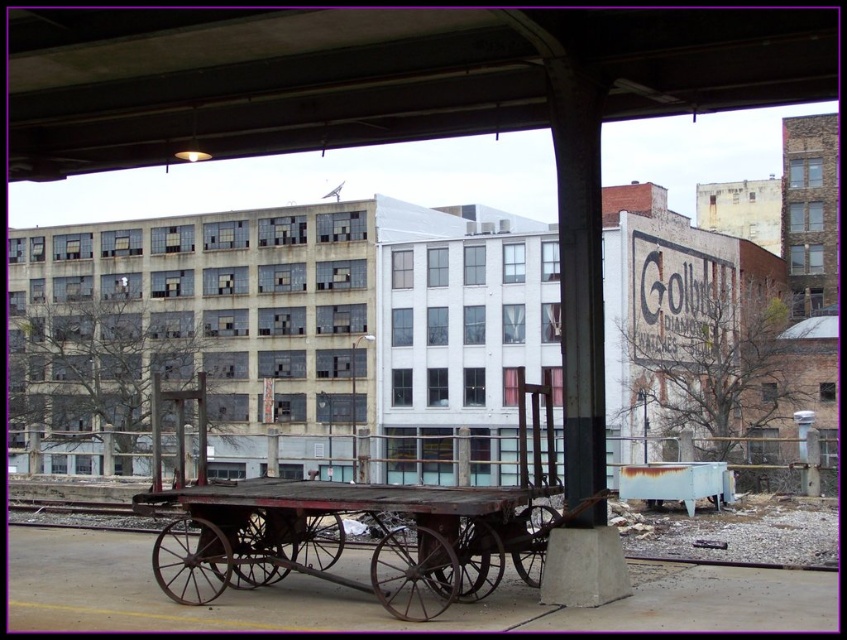
You are standing on the rusty metal train track at lower center and looking upward. Which direction should you turn to see the concrete ceiling at upper center?

You should turn to your right because the concrete ceiling at upper center is located to the right of the rusty metal train track at lower center.

You are a maintenance worker needing to inspect the concrete ceiling at upper center. You are standing on the rusty metal train track at lower center. Can you safely reach the ceiling from the track?

The concrete ceiling at upper center is positioned over the rusty metal train track at lower center, so yes, you can safely reach the ceiling from the track as it is directly above you.